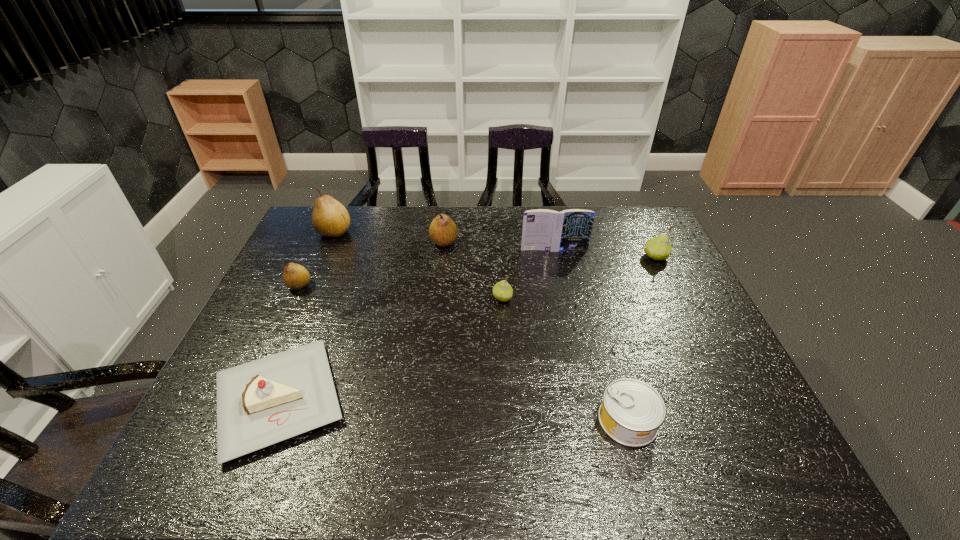
Locate an element on the screen. The height and width of the screenshot is (540, 960). the biggest brown pear is located at coordinates (330, 218).

Where is `book`? book is located at coordinates (548, 230).

At what (x,y) coordinates should I click in order to perform the action: click on the second smallest brown pear. Please return your answer as a coordinate pair (x, y). Looking at the image, I should click on (443, 231).

This screenshot has width=960, height=540. I want to click on the fourth object from left to right, so click(443, 231).

You are a GUI agent. You are given a task and a screenshot of the screen. Output one action in this format:
    pyautogui.click(x=<x>, y=<y>)
    Task: Click on the right green pear
    Image resolution: width=960 pixels, height=540 pixels.
    Given the screenshot: What is the action you would take?
    pyautogui.click(x=658, y=248)

Where is `the rightmost object`? the rightmost object is located at coordinates (658, 248).

Locate an element on the screen. the nearest brown pear is located at coordinates (296, 277).

The image size is (960, 540). Find the location of `the fifth object from left to right`. the fifth object from left to right is located at coordinates (502, 291).

You are a GUI agent. You are given a task and a screenshot of the screen. Output one action in this format:
    pyautogui.click(x=<x>, y=<y>)
    Task: Click on the smaller green pear
    Image resolution: width=960 pixels, height=540 pixels.
    Given the screenshot: What is the action you would take?
    pyautogui.click(x=502, y=291)

Find the location of a particular element. cake is located at coordinates (260, 403).